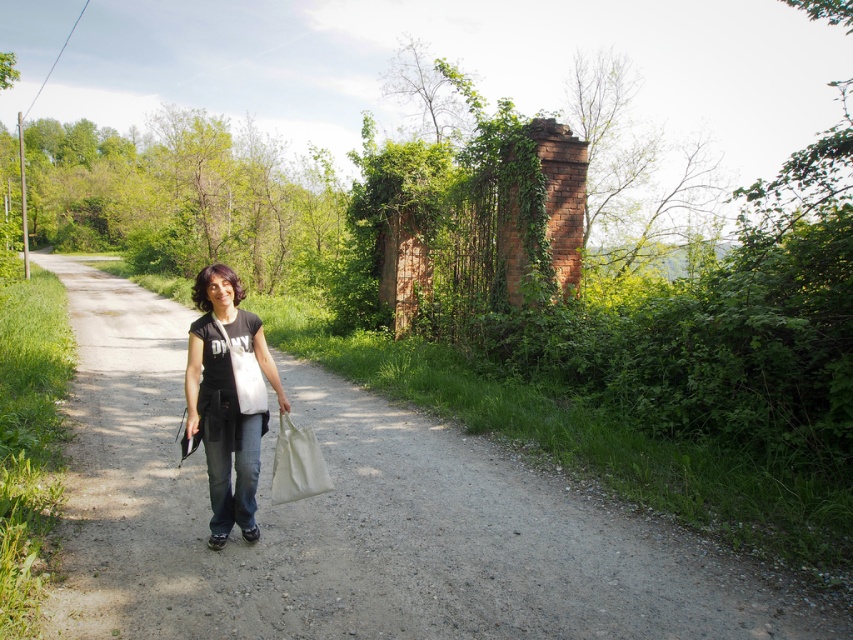
You are a photographer trying to capture the woman in the scene. You want to ensure both the black matte shirt at center and the white canvas bag at center are visible in your photo. Based on their positions, which one will appear higher in the frame?

The black matte shirt at center is located above the white canvas bag at center, so it will appear higher in the frame.

You are a delivery drone that needs to fly over the gravel path at center and the white canvas bag at center. What is the minimum distance you need to maintain between your flight path and the objects to ensure safety?

The gravel path at center and white canvas bag at center are 1.42 meters apart from each other. To ensure safety, the delivery drone should maintain a minimum distance of at least 1.42 meters between its flight path and the objects.

From the picture: The woman in the scene is holding two items. Which object is positioned to the left of the other between the black matte shirt at center and the white canvas bag at center?

The black matte shirt at center is positioned to the left of the white canvas bag at center.